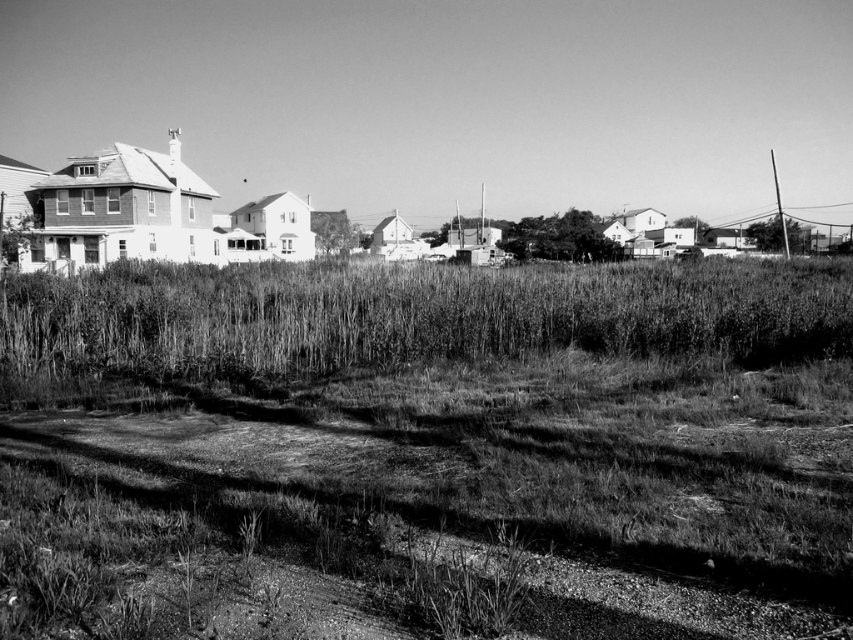
Question: Which point is closer to the camera taking this photo?

Choices:
 (A) (494, 531)
 (B) (502, 298)

Answer: (A)

Question: Which point is closer to the camera taking this photo?

Choices:
 (A) (564, 458)
 (B) (701, 342)

Answer: (A)

Question: Does dirt/gravel track at lower center have a lesser width compared to grassy field at center?

Choices:
 (A) yes
 (B) no

Answer: (A)

Question: Is dirt/gravel track at lower center to the right of grassy field at center from the viewer's perspective?

Choices:
 (A) no
 (B) yes

Answer: (A)

Question: Which point appears closest to the camera in this image?

Choices:
 (A) (157, 284)
 (B) (689, 632)

Answer: (B)

Question: From the image, what is the correct spatial relationship of dirt/gravel track at lower center in relation to grassy field at center?

Choices:
 (A) below
 (B) above

Answer: (A)